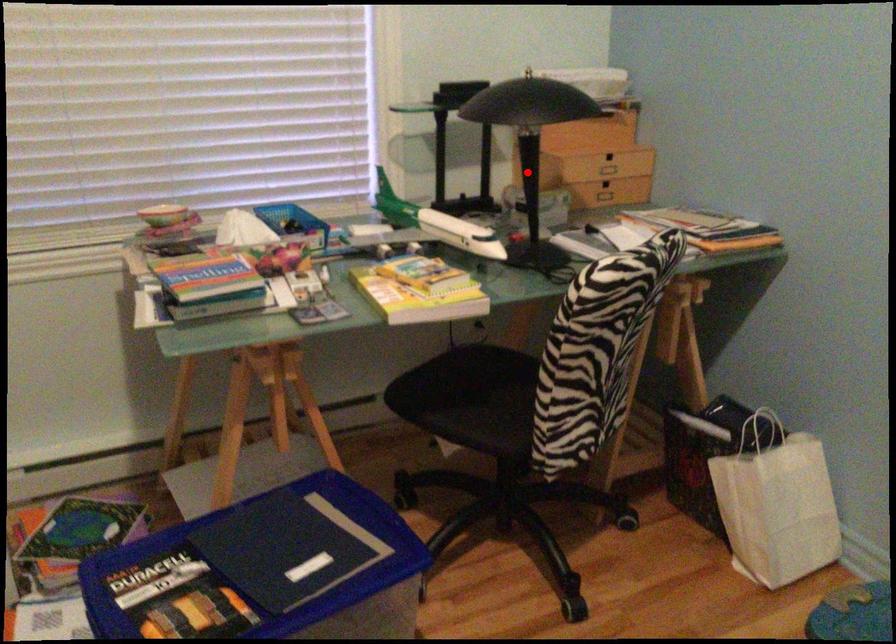
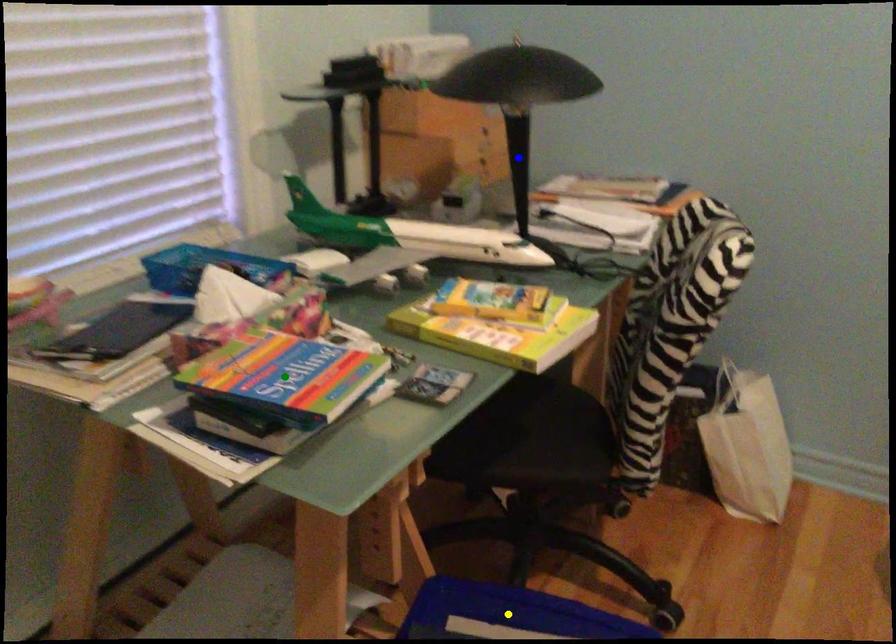
Question: I am providing you with two images of the same scene from different viewpoints. A red point is marked on the first image. You are given multiple points on the second image. Which point in image 2 represents the same 3d spot as the red point in image 1?

Choices:
 (A) blue point
 (B) yellow point
 (C) green point

Answer: (A)